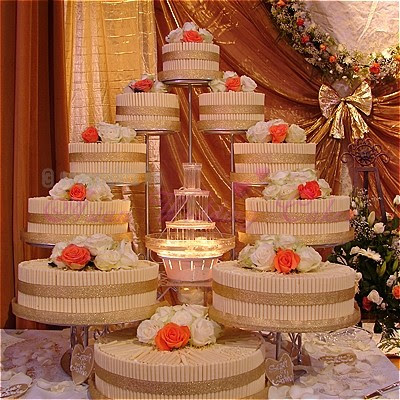
Find the location of a particular element. This screenshot has width=400, height=400. bottom supporting stand of cakes is located at coordinates (278, 348), (299, 348), (86, 335).